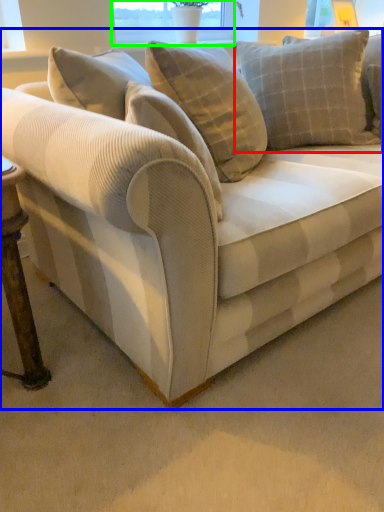
Question: Which is nearer to the pillow (highlighted by a red box)? studio couch (highlighted by a blue box) or window screen (highlighted by a green box).

Choices:
 (A) studio couch
 (B) window screen

Answer: (A)